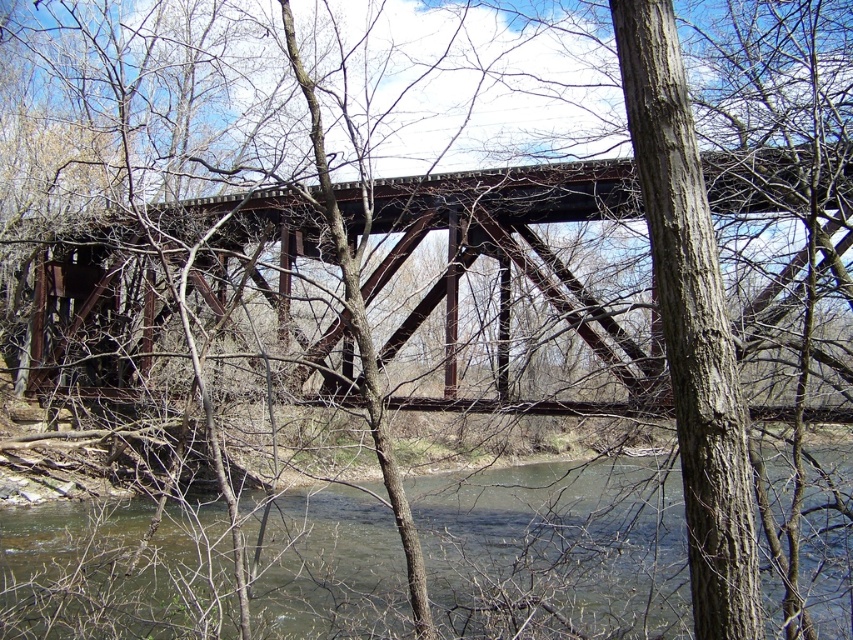
Question: Which point is closer to the camera taking this photo?

Choices:
 (A) (641, 387)
 (B) (613, 589)

Answer: (B)

Question: Among these objects, which one is nearest to the camera?

Choices:
 (A) rusty metal bridge at center
 (B) greenish-brown water at lower center

Answer: (A)

Question: Among these objects, which one is nearest to the camera?

Choices:
 (A) greenish-brown water at lower center
 (B) rusty metal bridge at center

Answer: (B)

Question: In this image, where is greenish-brown water at lower center located relative to rusty metal bridge at center?

Choices:
 (A) below
 (B) above

Answer: (A)

Question: Observing the image, what is the correct spatial positioning of greenish-brown water at lower center in reference to rusty metal bridge at center?

Choices:
 (A) below
 (B) above

Answer: (A)

Question: Is greenish-brown water at lower center thinner than rusty metal bridge at center?

Choices:
 (A) no
 (B) yes

Answer: (B)